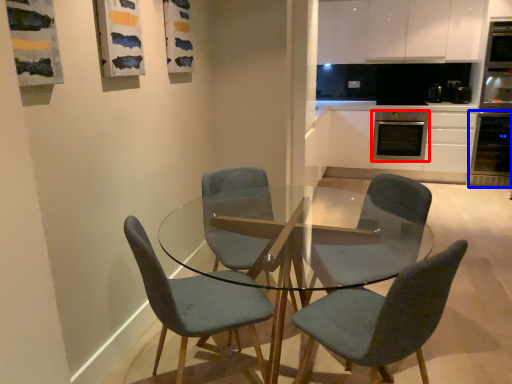
Question: Among these objects, which one is nearest to the camera, kitchen appliance (highlighted by a red box) or oven (highlighted by a blue box)?

Choices:
 (A) kitchen appliance
 (B) oven

Answer: (B)